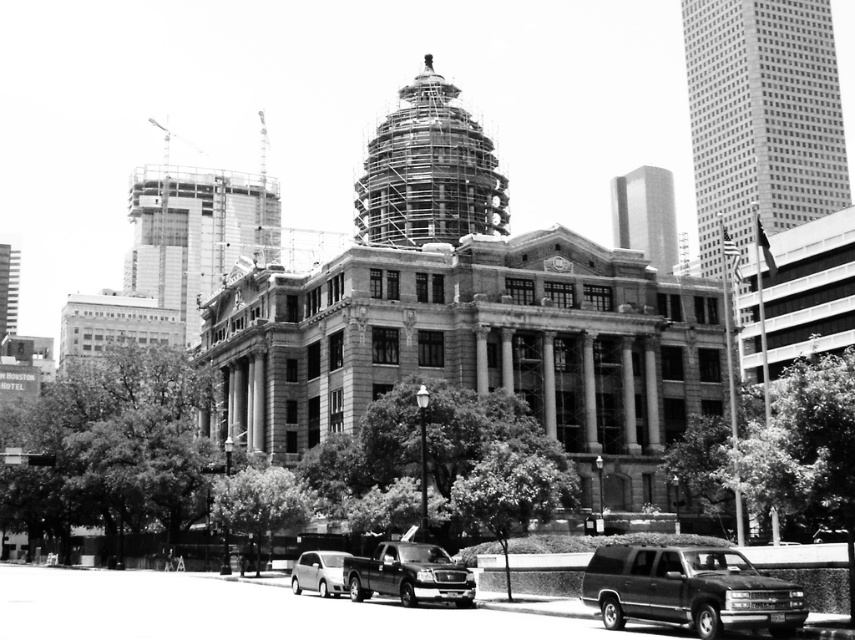
You are a pedestrian standing at the entrance of the large classical building under construction. You need to walk to the shiny black truck at lower center and the silver metallic hatchback at lower left. Which vehicle will you encounter first?

You will encounter the shiny black truck at lower center first because it is positioned in front of the silver metallic hatchback at lower left, making it closer to your starting point at the building entrance.

You are a delivery driver who needs to park your vehicle between the shiny black suv at lower right and the silver metallic hatchback at lower left. Is there enough space between them for your truck, which is 2 meters wide?

The shiny black suv at lower right is to the right of the silver metallic hatchback at lower left. However, the exact distance between them is not provided, so it is impossible to determine if there is enough space for a 2 meter wide truck.